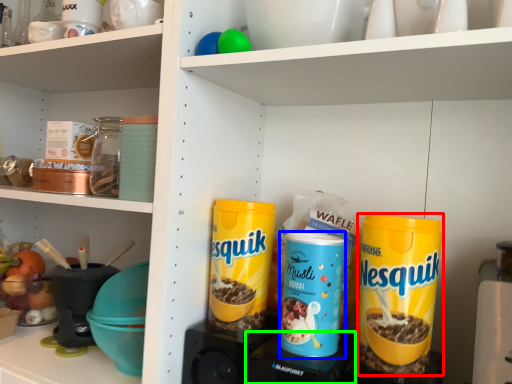
Question: Which is nearer to the cereal (highlighted by a red box)? product (highlighted by a blue box) or appliance (highlighted by a green box).

Choices:
 (A) product
 (B) appliance

Answer: (A)